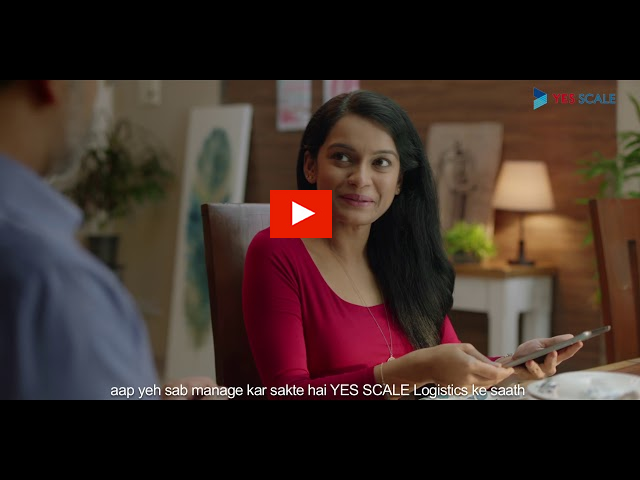
Image resolution: width=640 pixels, height=480 pixels. I want to click on houseplant, so click(102, 179).